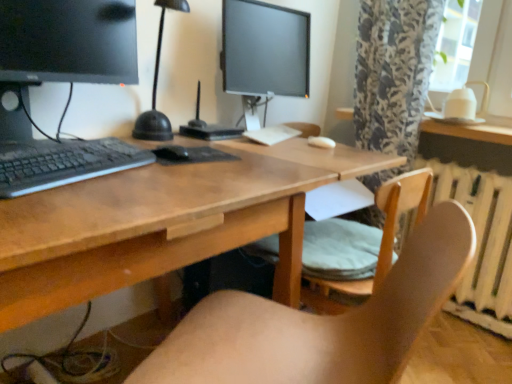
In order to click on vacant space behind black matte mouse at center in this screenshot , I will do `click(178, 140)`.